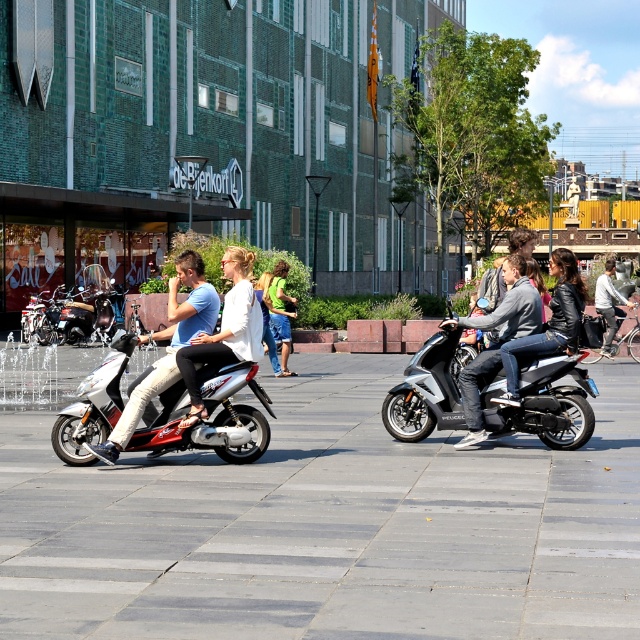
In the scene shown: Who is higher up, shiny metallic scooter at left or green fabric shirt at center?

green fabric shirt at center

Which is more to the right, shiny metallic scooter at left or green fabric shirt at center?

Positioned to the right is green fabric shirt at center.

Is point (230, 449) farther from camera compared to point (273, 316)?

No, (230, 449) is closer to viewer.

Where is `shiny metallic scooter at left`? shiny metallic scooter at left is located at coordinates (209, 413).

Is leather jacket at center bigger than denim jacket at center?

No.

Which is in front, point (556, 294) or point (608, 333)?

Positioned in front is point (556, 294).

Who is more forward, (552, 324) or (630, 289)?

Point (552, 324) is in front.

Image resolution: width=640 pixels, height=640 pixels. In order to click on leather jacket at center in this screenshot , I will do `click(548, 323)`.

Can you confirm if shiny metallic scooter at left is wider than matte white scooter at left?

Yes, shiny metallic scooter at left is wider than matte white scooter at left.

Does point (93, 436) lie behind point (145, 403)?

Yes.

Identify the location of shiny metallic scooter at left. (209, 413).